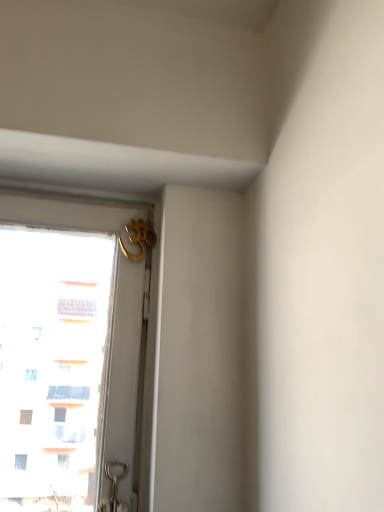
Image resolution: width=384 pixels, height=512 pixels. Describe the element at coordinates (139, 238) in the screenshot. I see `gold metallic om symbol at upper left` at that location.

Locate an element on the screen. The height and width of the screenshot is (512, 384). gold metallic om symbol at upper left is located at coordinates (139, 238).

In order to face gold metallic om symbol at upper left, should I rotate leftwards or rightwards?

You should rotate left by 7.304 degrees.

Where is `gold metallic om symbol at upper left`? This screenshot has width=384, height=512. gold metallic om symbol at upper left is located at coordinates (139, 238).